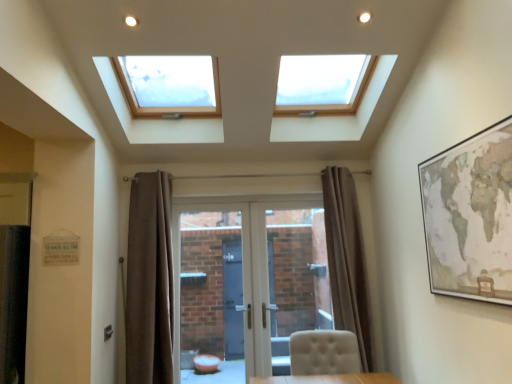
Question: From the image's perspective, is brown fabric curtain at center, arranged as the 1th curtain when viewed from the right, under matte brown map at right?

Choices:
 (A) yes
 (B) no

Answer: (A)

Question: Considering the relative sizes of brown fabric curtain at center, positioned as the second curtain in left-to-right order, and matte brown map at right in the image provided, is brown fabric curtain at center, positioned as the second curtain in left-to-right order, thinner than matte brown map at right?

Choices:
 (A) yes
 (B) no

Answer: (B)

Question: Is brown fabric curtain at center, positioned as the second curtain in left-to-right order, facing towards matte brown map at right?

Choices:
 (A) yes
 (B) no

Answer: (A)

Question: Are brown fabric curtain at center, arranged as the 1th curtain when viewed from the right, and matte brown map at right making contact?

Choices:
 (A) no
 (B) yes

Answer: (A)

Question: Is brown fabric curtain at center, positioned as the second curtain in left-to-right order, positioned behind matte brown map at right?

Choices:
 (A) no
 (B) yes

Answer: (B)

Question: From a real-world perspective, is brown fabric curtain at center, positioned as the second curtain in left-to-right order, below matte brown map at right?

Choices:
 (A) no
 (B) yes

Answer: (B)

Question: Does white glossy door at center have a greater width compared to matte brown map at right?

Choices:
 (A) no
 (B) yes

Answer: (B)

Question: Is matte brown map at right surrounded by white glossy door at center?

Choices:
 (A) no
 (B) yes

Answer: (A)

Question: Is white glossy door at center closer to camera compared to matte brown map at right?

Choices:
 (A) no
 (B) yes

Answer: (A)

Question: Considering the relative sizes of white glossy door at center and matte brown map at right in the image provided, is white glossy door at center smaller than matte brown map at right?

Choices:
 (A) no
 (B) yes

Answer: (A)

Question: Would you say white glossy door at center is a long distance from matte brown map at right?

Choices:
 (A) yes
 (B) no

Answer: (A)

Question: Is white glossy door at center facing away from matte brown map at right?

Choices:
 (A) yes
 (B) no

Answer: (B)

Question: Does brown fabric curtain at center, positioned as the second curtain in left-to-right order, have a greater width compared to white glossy door at center?

Choices:
 (A) yes
 (B) no

Answer: (A)